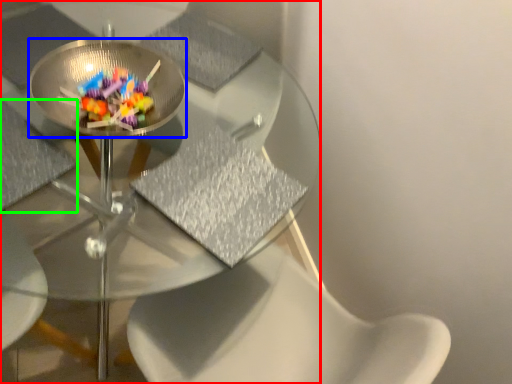
Question: Which is farther away from table (highlighted by a red box)? glass plate (highlighted by a blue box) or chair (highlighted by a green box)?

Choices:
 (A) glass plate
 (B) chair

Answer: (B)